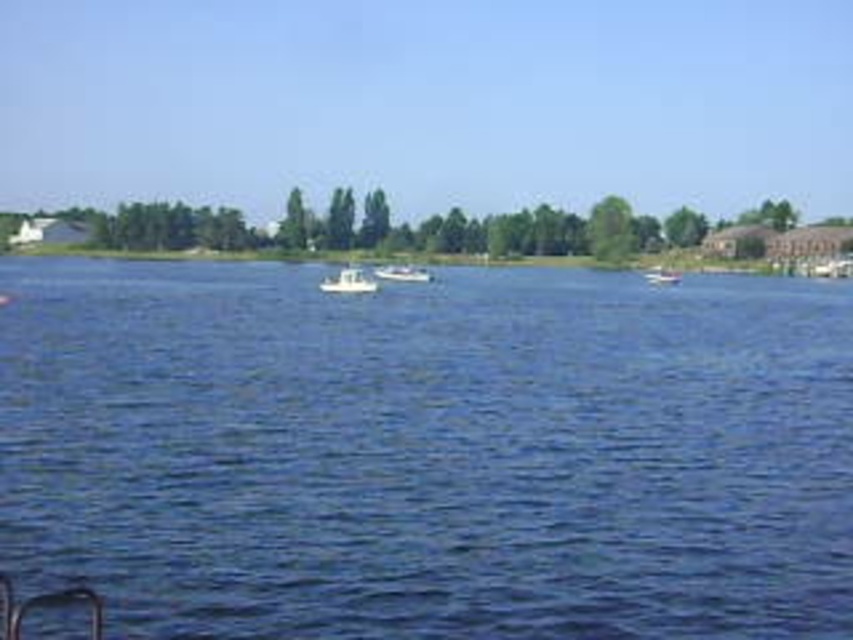
You are standing on the shore of the lake and want to reach the white matte boat at right. Which direction should you head towards from the blue liquid water at center?

You should head to the right from the blue liquid water at center to reach the white matte boat at right since the blue liquid water at center is located to the left of the white matte boat at right.

You are a photographer trying to capture the white plastic boat at center and the white matte boat at center in a single shot. Which boat will appear closer to the camera in your photo?

The white plastic boat at center appears closer to the camera because it is positioned in front of the white matte boat at center.